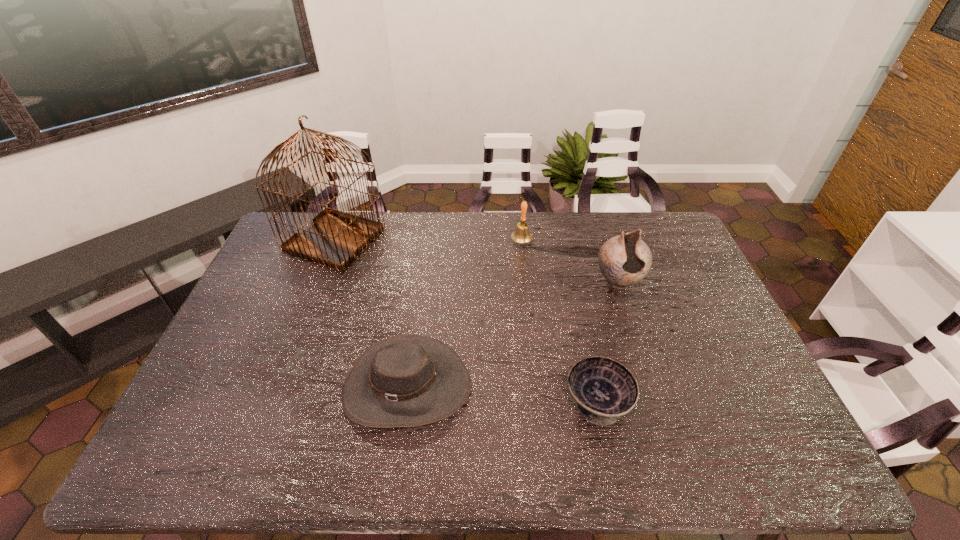
You are a GUI agent. You are given a task and a screenshot of the screen. Output one action in this format:
    pyautogui.click(x=<x>, y=<y>)
    Task: Click on the vacant space at the far right corner of the desktop
    This screenshot has height=540, width=960.
    Given the screenshot: What is the action you would take?
    pyautogui.click(x=651, y=227)

Identify the location of unoccupied area between the tallest object and the bowl. Image resolution: width=960 pixels, height=540 pixels. 467,321.

The height and width of the screenshot is (540, 960). I want to click on free area in between the pottery and the bowl, so click(x=608, y=342).

Where is `free space between the second tallest object and the tallest object`? free space between the second tallest object and the tallest object is located at coordinates (476, 261).

The height and width of the screenshot is (540, 960). What are the coordinates of `free point between the bowl and the third object from left to right` in the screenshot? It's located at (560, 322).

The height and width of the screenshot is (540, 960). In order to click on free space that is in between the birdcage and the pottery in this screenshot , I will do `click(476, 261)`.

Identify the location of empty location between the cowboy hat and the bell. (464, 314).

You are a GUI agent. You are given a task and a screenshot of the screen. Output one action in this format:
    pyautogui.click(x=<x>, y=<y>)
    Task: Click on the empty space that is in between the bowl and the pottery
    
    Given the screenshot: What is the action you would take?
    pyautogui.click(x=608, y=342)

Locate an element on the screen. The height and width of the screenshot is (540, 960). vacant area that lies between the birdcage and the pottery is located at coordinates (476, 261).

You are a GUI agent. You are given a task and a screenshot of the screen. Output one action in this format:
    pyautogui.click(x=<x>, y=<y>)
    Task: Click on the vacant space in between the bowl and the cowboy hat
    The width and height of the screenshot is (960, 540).
    Given the screenshot: What is the action you would take?
    pyautogui.click(x=502, y=394)